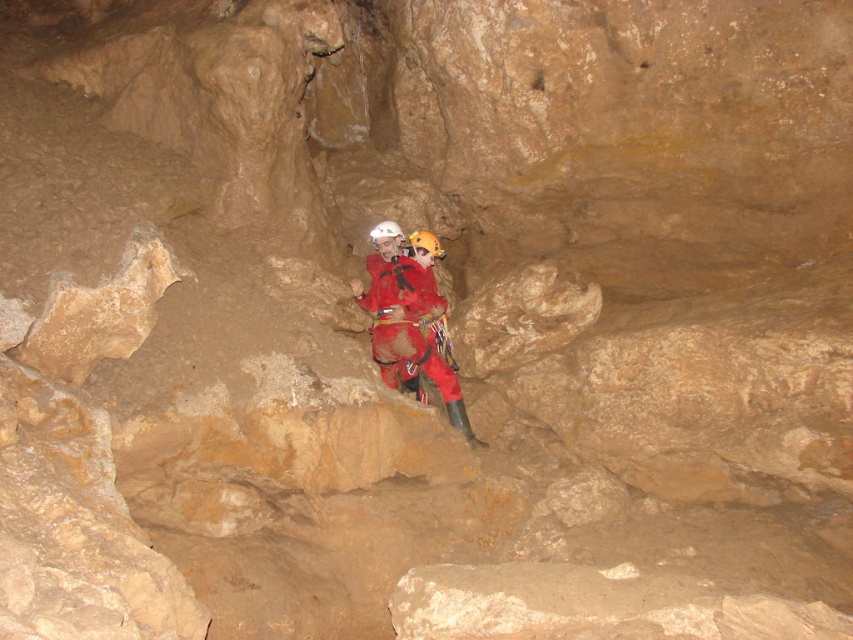
Looking at this image, you are planning to place a small flashlight on the ground between the red matte climbing gear at center and the yellow matte helmet at center. Considering their heights, which object will cast a longer shadow on the ground?

The red matte climbing gear at center is taller than the yellow matte helmet at center, so it will cast a longer shadow on the ground.

You are a photographer standing in the cave. You want to capture a photo of the point at coordinates point [397,252]. Your camera has a focal length of 50mm and a sensor size of 24mm. What is the minimum distance you need to move forward to ensure the point fills the sensor vertically?

The point at coordinates point [397,252] is 6.60 meters away from the camera. To calculate the minimum distance needed, use the formula distance_required equals focal_length divided by sensor_size multiplied by subject_size. However, since the subject size isn t provided, we can t compute the exact distance. Please provide the height of the point to proceed.